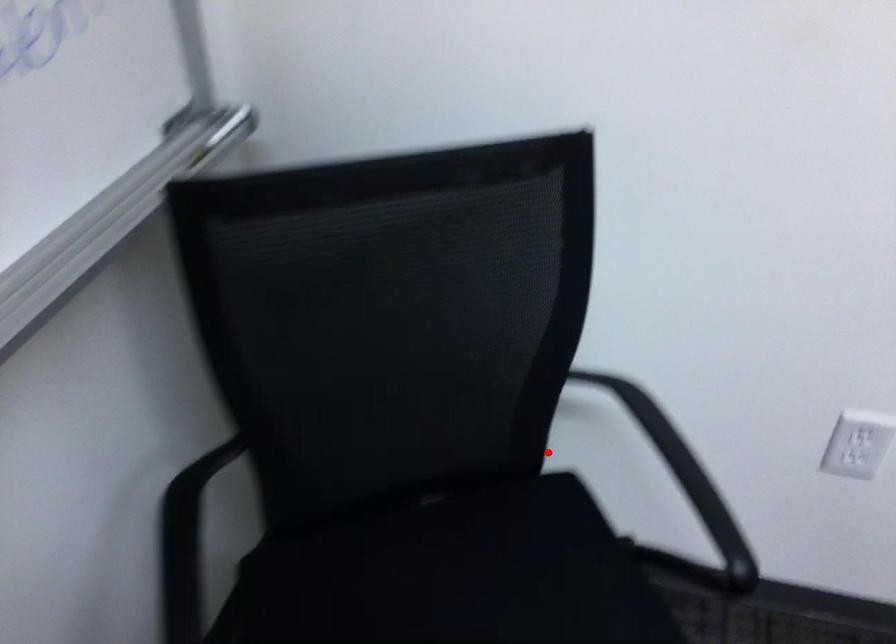
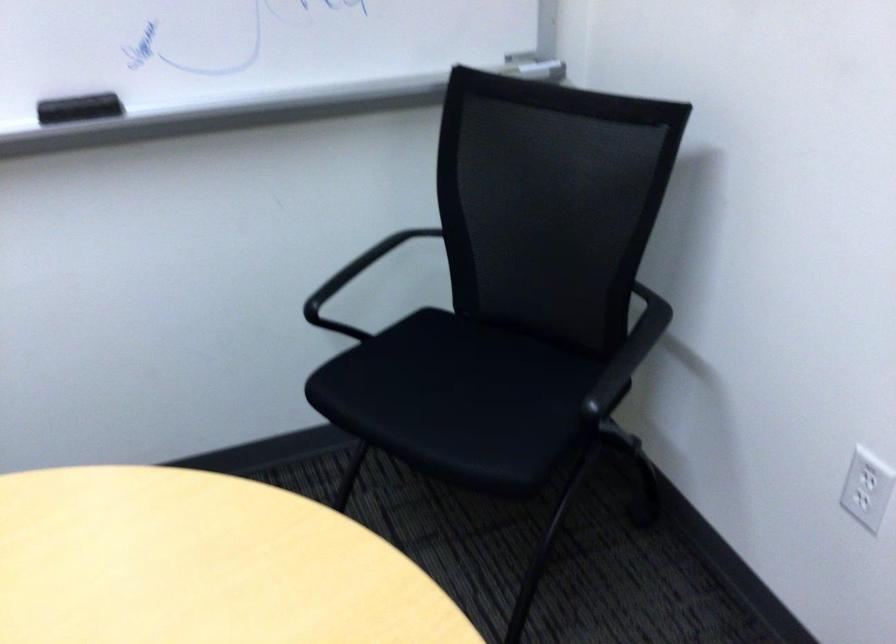
Question: I am providing you with two images of the same scene from different viewpoints. In image1, a red point is highlighted. Considering the same 3D point in image2, which of the following is correct?

Choices:
 (A) It is closer
 (B) It is farther

Answer: (B)